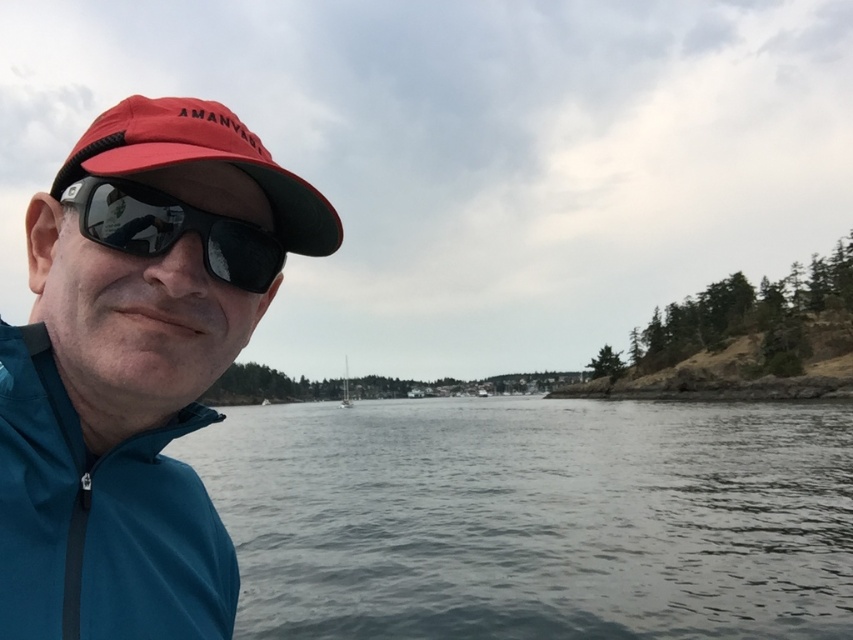
You are a photographer standing at the edge of the water. You want to capture a photo of the gray water at center without any obstructions. The camera you are using has a minimum focusing distance of 3 meters. Will you be able to take the photo clearly?

The gray water at center is 2.88 meters away from the camera. Since the minimum focusing distance is 3 meters, the camera cannot focus properly at 2.88 meters. Therefore, you will not be able to take a clear photo of the gray water at center without moving further back.

You are a photographer trying to capture the reflection of the gray water at center in your shot. Since the black matte sunglasses at left might block the view, where should you position the camera relative to the person?

To capture the reflection of the gray water at center without obstruction from the black matte sunglasses at left, position the camera below the level of the black matte sunglasses at left, as the gray water at center is located below it.

You are a photographer trying to capture the reflection of the gray water at center in your shot. Since the black matte sunglasses at left might block part of the reflection, will you need to adjust your position to avoid the sunglasses?

The gray water at center is much taller than the black matte sunglasses at left, so the reflection of the gray water at center will extend above the sunglasses, meaning you don not need to adjust your position to avoid the sunglasses blocking the reflection.